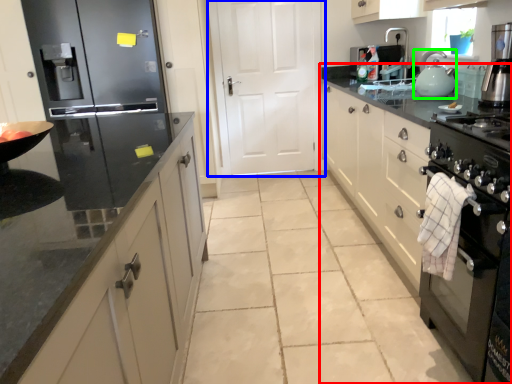
Question: Which object is the farthest from countertop (highlighted by a red box)? Choose among these: door (highlighted by a blue box) or kitchen appliance (highlighted by a green box).

Choices:
 (A) door
 (B) kitchen appliance

Answer: (A)